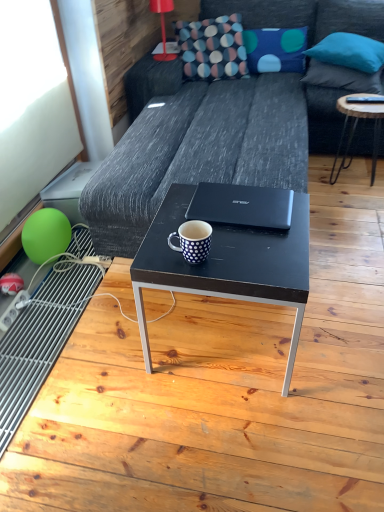
The height and width of the screenshot is (512, 384). I want to click on vacant space that is to the left of white dotted mug at center, so click(156, 252).